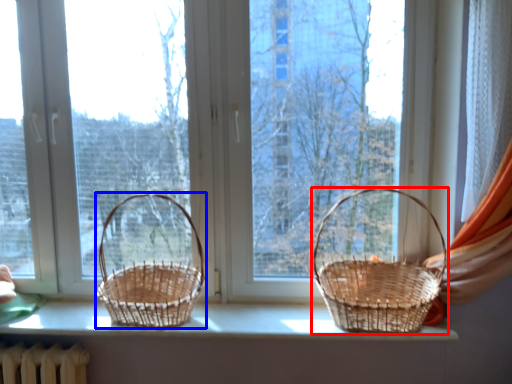
Question: Which of the following is the closest to the observer, picnic basket (highlighted by a red box) or picnic basket (highlighted by a blue box)?

Choices:
 (A) picnic basket
 (B) picnic basket

Answer: (A)